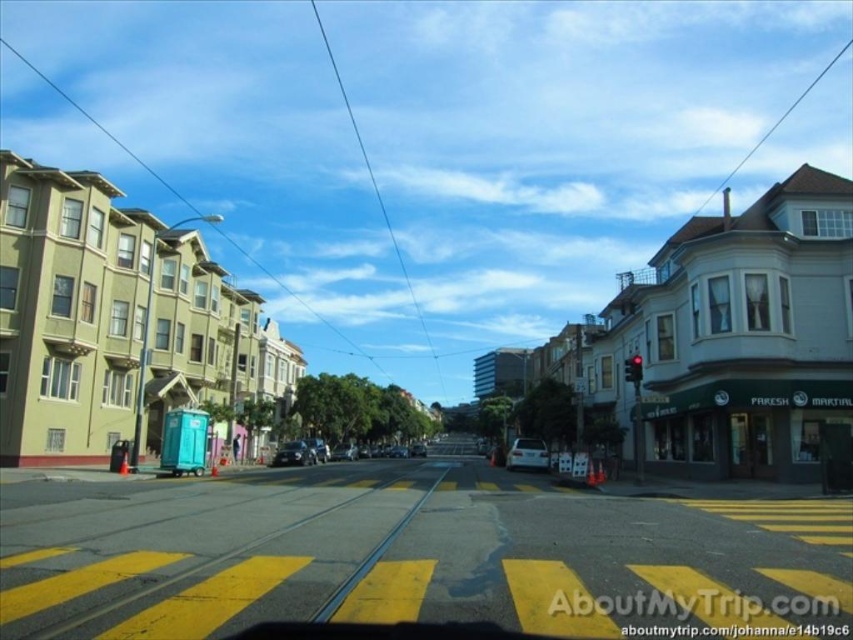
Question: Considering the relative positions of white matte car at center and shiny silver sedan at center in the image provided, where is white matte car at center located with respect to shiny silver sedan at center?

Choices:
 (A) left
 (B) right

Answer: (B)

Question: Is yellow asphalt at center smaller than white matte car at center?

Choices:
 (A) yes
 (B) no

Answer: (B)

Question: Observing the image, what is the correct spatial positioning of yellow asphalt at center in reference to white matte car at center?

Choices:
 (A) above
 (B) below

Answer: (A)

Question: Which point is closer to the camera?

Choices:
 (A) (x=515, y=442)
 (B) (x=308, y=452)
 (C) (x=352, y=605)

Answer: (C)

Question: Which of these objects is positioned farthest from the white matte car at center?

Choices:
 (A) yellow asphalt at center
 (B) shiny silver sedan at center

Answer: (A)

Question: Which of the following is the closest to the observer?

Choices:
 (A) white matte car at center
 (B) shiny silver sedan at center
 (C) yellow asphalt at center

Answer: (C)